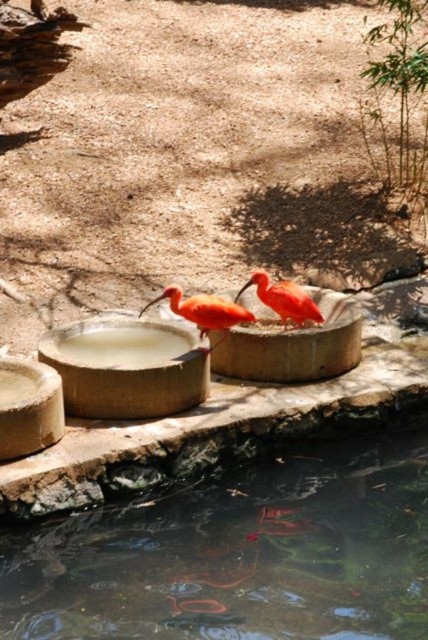
You are a photographer trying to capture the orange matte ibis at center and the smooth concrete basin at lower left in a single frame. Given that the ibis is currently positioned closer to the camera than the basin, can you estimate whether the ibis will appear larger in the photo compared to the basin?

The smooth concrete basin at lower left is wider than the orange matte ibis at center. Even though the ibis is closer to the camera, the basin is wider, so it might still appear larger in the photo depending on their actual sizes and distances.

You are a birdwatcher observing the scene. You notice the clear water at pond center and the orange matte ibis at center. Which object is higher in the scene?

The clear water at pond center is taller than the orange matte ibis at center, so the clear water at pond center is higher in the scene.

Based on the photo, you are a photographer trying to capture both the orange matte ibis at center and the bright orange bird at center in a single shot. Since you want to highlight their positions relative to each other, which ibis is located to the left of the other?

The orange matte ibis at center is positioned on the left side of bright orange bird at center.